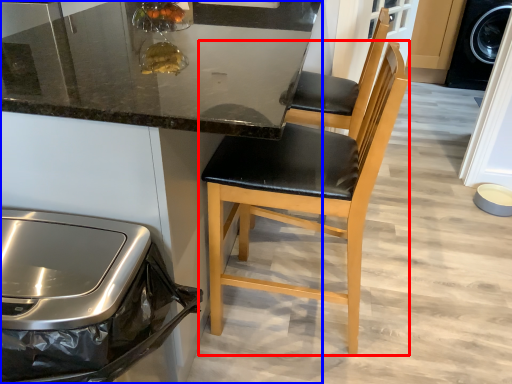
Question: Which object is further to the camera taking this photo, chair (highlighted by a red box) or cabinetry (highlighted by a blue box)?

Choices:
 (A) chair
 (B) cabinetry

Answer: (A)